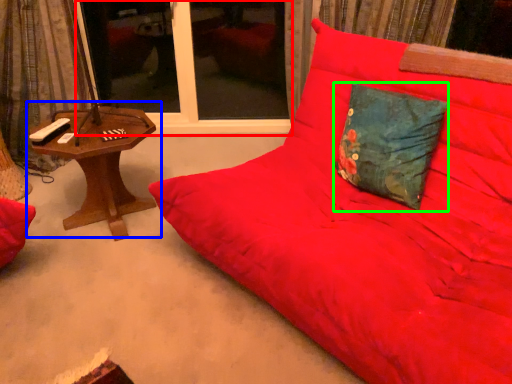
Question: Based on their relative distances, which object is nearer to window screen (highlighted by a red box)? Choose from table (highlighted by a blue box) and pillow (highlighted by a green box).

Choices:
 (A) table
 (B) pillow

Answer: (A)